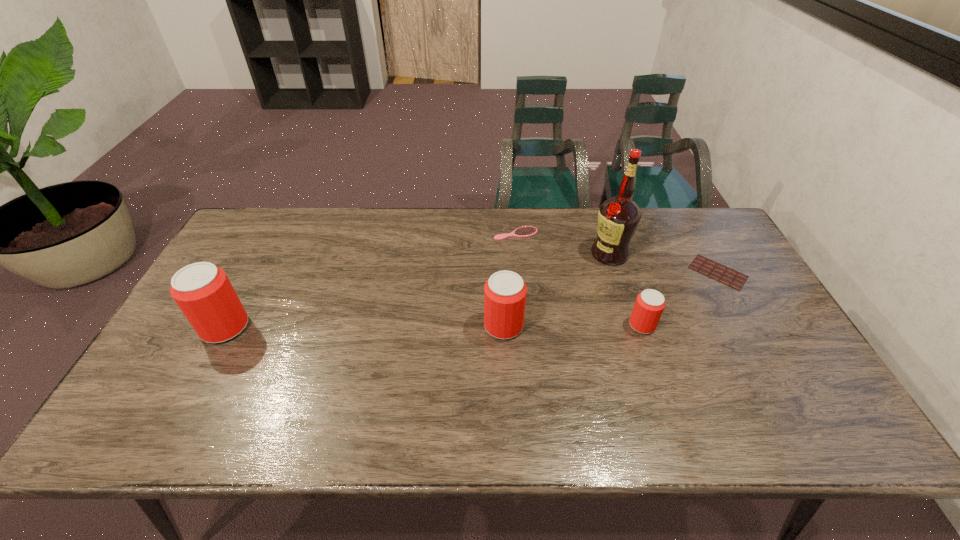
Where is `object that is positioned at the left edge`? Image resolution: width=960 pixels, height=540 pixels. object that is positioned at the left edge is located at coordinates (203, 292).

The width and height of the screenshot is (960, 540). I want to click on object at the right edge, so click(730, 277).

At what (x,y) coordinates should I click in order to perform the action: click on vacant space at the far edge of the desktop. Please return your answer as a coordinate pair (x, y). Looking at the image, I should click on (420, 240).

The image size is (960, 540). I want to click on free region at the near edge of the desktop, so click(338, 389).

This screenshot has width=960, height=540. Identify the location of vacant point at the left edge. (187, 356).

This screenshot has width=960, height=540. What are the coordinates of `vacant area at the right edge` in the screenshot? It's located at (749, 279).

Locate an element on the screen. vacant space at the far left corner is located at coordinates (278, 219).

Locate an element on the screen. The width and height of the screenshot is (960, 540). free space between the leftmost object and the hairbrush is located at coordinates (371, 281).

Locate an element on the screen. The height and width of the screenshot is (540, 960). vacant space that is in between the farthest object and the leftmost beer can is located at coordinates (371, 281).

Locate an element on the screen. vacant space that's between the leftmost beer can and the farthest object is located at coordinates (371, 281).